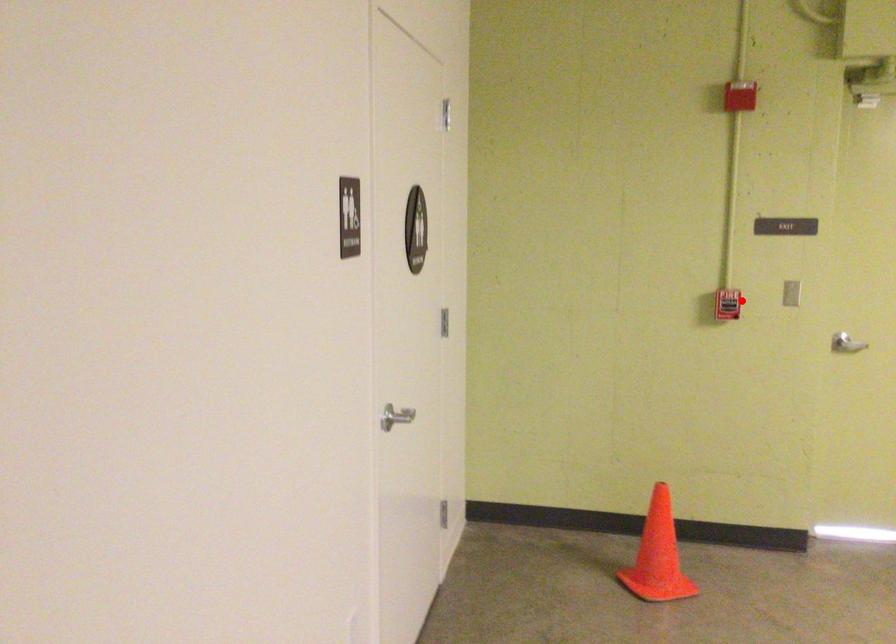
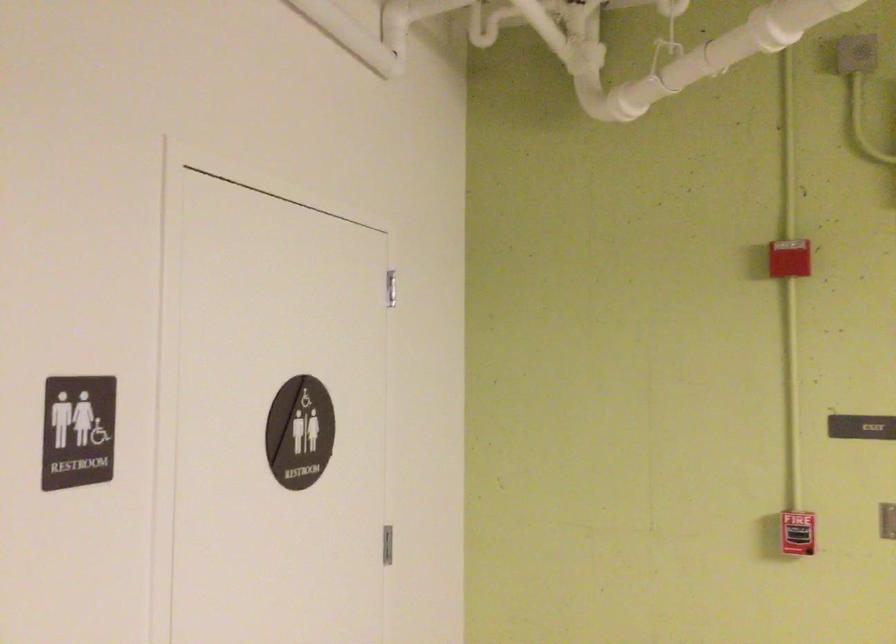
Question: I am providing you with two images of the same scene from different viewpoints. In image1, a red point is highlighted. Considering the same 3D point in image2, which of the following is correct?

Choices:
 (A) It is closer
 (B) It is farther

Answer: (A)